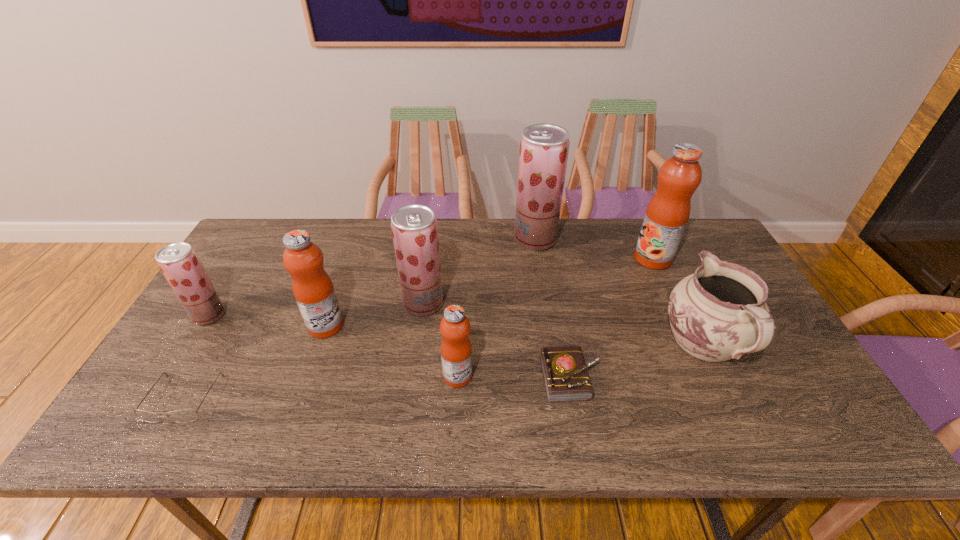
Identify the location of the biggest strawberry fruit juice. (544, 148).

This screenshot has height=540, width=960. What are the coordinates of `the rightmost strawberry fruit juice` in the screenshot? It's located at (544, 148).

Identify the location of the rightmost orange fruit juice. (667, 214).

Locate an element on the screen. The image size is (960, 540). the rightmost fruit juice is located at coordinates [667, 214].

Image resolution: width=960 pixels, height=540 pixels. What are the coordinates of `the second biggest strawberry fruit juice` in the screenshot? It's located at (414, 229).

Where is `the second strawberry fruit juice from left to right`? the second strawberry fruit juice from left to right is located at coordinates (414, 229).

Locate an element on the screen. The width and height of the screenshot is (960, 540). the seventh object from right to left is located at coordinates (313, 289).

What are the coordinates of `the second biggest orange fruit juice` in the screenshot? It's located at (313, 289).

This screenshot has height=540, width=960. What are the coordinates of `the leftmost fruit juice` in the screenshot? It's located at (179, 263).

At what (x,y) coordinates should I click in order to perform the action: click on the leftmost strawberry fruit juice. Please return your answer as a coordinate pair (x, y). The image size is (960, 540). Looking at the image, I should click on (179, 263).